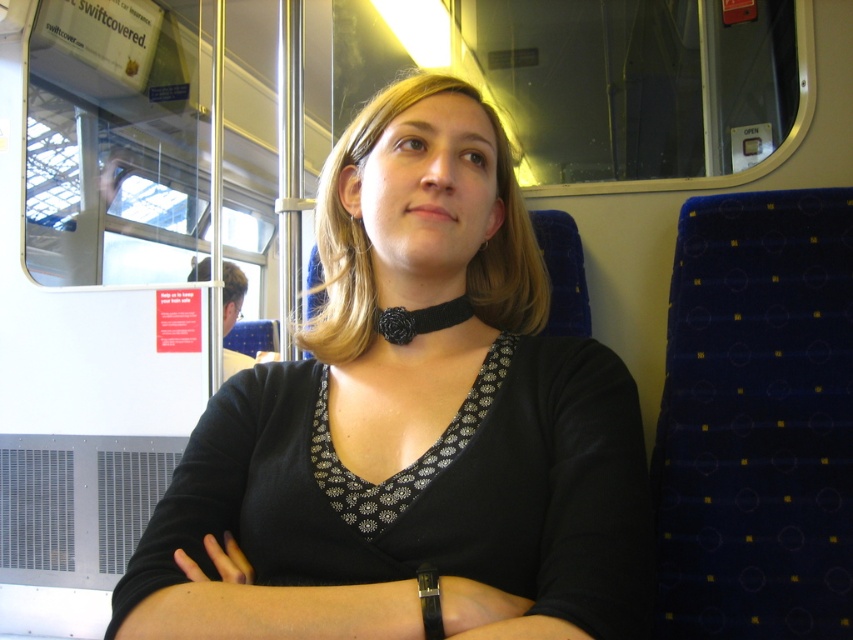
You are a fashion designer observing the person in the train carriage. You notice the black matte choker at center and the black fabric neckband at center. Which of these two items is visible closer to the viewer?

The black matte choker at center is in front of the black fabric neckband at center, making it the visible item closer to the viewer.

You are a fashion designer analyzing the image of a person in a train carriage. You need to determine which of the two items around the neck is larger. The items are the black matte choker at center and the black fabric neckband at center. Which one is larger?

The black matte choker at center is bigger than the black fabric neckband at center.

You are a fashion designer analyzing the neck accessories in the image. Which object is wider between the black matte choker at center and the black fabric neckband at center?

The black matte choker at center might be wider than black fabric neckband at center.